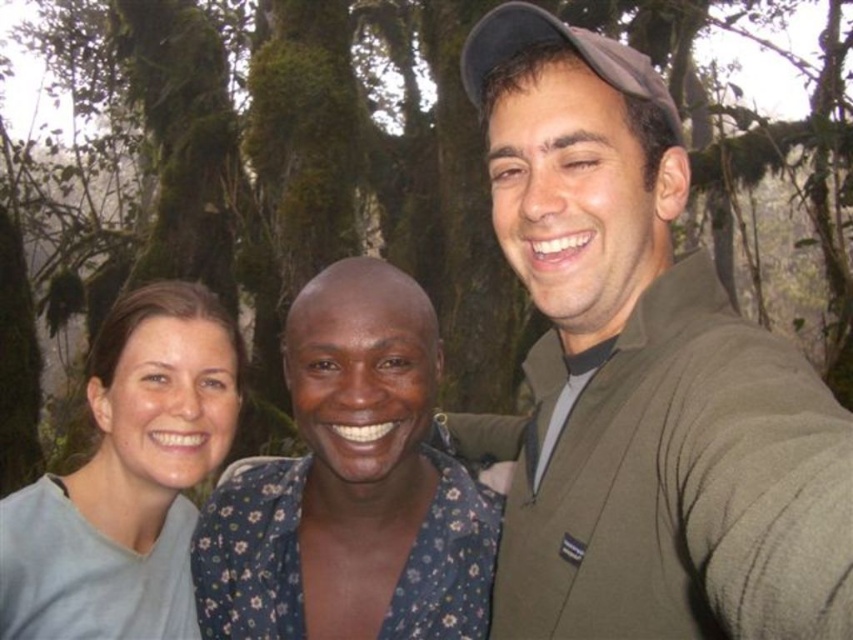
You are taking a photo of the three people in the forest. You want to ensure that the green sweater at center and the matte gray shirt at center are both visible in the frame. Based on their positions, which shirt should you focus on first to capture both in the shot?

The green sweater at center is to the right of the matte gray shirt at center. To capture both in the frame, focus on the matte gray shirt at center first since it is on the left, then adjust the camera to include the green sweater at center on the right.

You are a photographer trying to capture a group photo of the three people in the forest. You want to ensure that both the point at (281, 253) and the point at (679, 467) are visible in the background. Since you can only focus on one point at a time, which point should you focus on to make sure both are in focus?

You should focus on point (679, 467) because it is closer to the camera than point (281, 253). By focusing on the closer point, the depth of field will extend backward, allowing both points to be in focus.